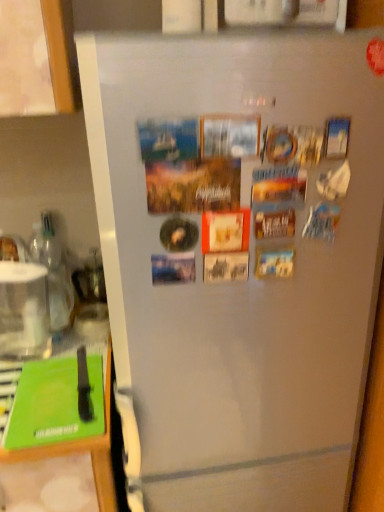
Question: Would you say clear glass water at left is inside or outside green matte magazine at lower left?

Choices:
 (A) outside
 (B) inside

Answer: (A)

Question: Is clear glass water at left wider or thinner than green matte magazine at lower left?

Choices:
 (A) thin
 (B) wide

Answer: (A)

Question: Estimate the real-world distances between objects in this image. Which object is closer to the green plastic cutting board at lower left?

Choices:
 (A) clear glass water at left
 (B) green matte magazine at lower left

Answer: (B)

Question: Based on their relative distances, which object is farther from the green matte magazine at lower left?

Choices:
 (A) green plastic cutting board at lower left
 (B) clear glass water at left

Answer: (B)